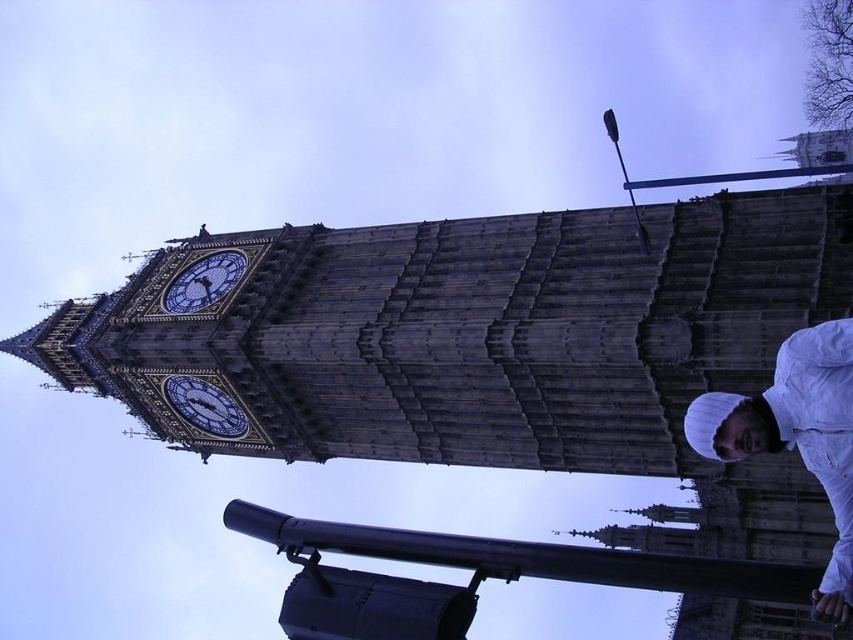
Question: Which object appears closest to the camera in this image?

Choices:
 (A) stone clock tower at center
 (B) white matte jacket at lower right
 (C) dark blue stone clock at upper center
 (D) black metal pole at lower center

Answer: (D)

Question: Is dark blue stone clock at upper center bigger than blue painted stone clock at upper center?

Choices:
 (A) yes
 (B) no

Answer: (A)

Question: Which object appears farthest from the camera in this image?

Choices:
 (A) blue painted stone clock at upper center
 (B) dark blue stone clock at upper center
 (C) stone clock tower at center

Answer: (A)

Question: Is stone clock tower at center to the right of black metal pole at lower center from the viewer's perspective?

Choices:
 (A) no
 (B) yes

Answer: (A)

Question: Observing the image, what is the correct spatial positioning of black metal pole at lower center in reference to blue painted stone clock at upper center?

Choices:
 (A) above
 (B) below

Answer: (B)

Question: Which of the following is the closest to the observer?

Choices:
 (A) black metal pole at lower center
 (B) stone clock tower at center

Answer: (A)